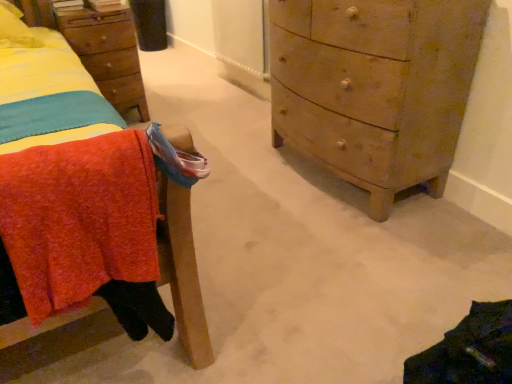
Question: Is wooden chest of drawers at right surrounded by knitted wool blanket at left?

Choices:
 (A) no
 (B) yes

Answer: (A)

Question: Does knitted wool blanket at left lie in front of wooden chest of drawers at right?

Choices:
 (A) no
 (B) yes

Answer: (B)

Question: Considering the relative sizes of knitted wool blanket at left and wooden chest of drawers at right in the image provided, is knitted wool blanket at left bigger than wooden chest of drawers at right?

Choices:
 (A) no
 (B) yes

Answer: (A)

Question: Does knitted wool blanket at left appear on the left side of wooden chest of drawers at right?

Choices:
 (A) yes
 (B) no

Answer: (A)

Question: From a real-world perspective, is knitted wool blanket at left located higher than wooden chest of drawers at right?

Choices:
 (A) no
 (B) yes

Answer: (B)

Question: Is wooden chest of drawers at right inside or outside of wooden nightstand at upper left?

Choices:
 (A) inside
 (B) outside

Answer: (B)

Question: In terms of width, does wooden chest of drawers at right look wider or thinner when compared to wooden nightstand at upper left?

Choices:
 (A) wide
 (B) thin

Answer: (A)

Question: Visually, is wooden chest of drawers at right positioned to the left or to the right of wooden nightstand at upper left?

Choices:
 (A) right
 (B) left

Answer: (A)

Question: Does point (374, 92) appear closer or farther from the camera than point (119, 99)?

Choices:
 (A) closer
 (B) farther

Answer: (A)

Question: From the image's perspective, is knitted wool blanket at left above or below wooden chest of drawers at right?

Choices:
 (A) below
 (B) above

Answer: (A)

Question: Is knitted wool blanket at left inside the boundaries of wooden chest of drawers at right, or outside?

Choices:
 (A) outside
 (B) inside

Answer: (A)

Question: In terms of height, does knitted wool blanket at left look taller or shorter compared to wooden chest of drawers at right?

Choices:
 (A) short
 (B) tall

Answer: (A)

Question: From a real-world perspective, relative to wooden chest of drawers at right, is knitted wool blanket at left vertically above or below?

Choices:
 (A) above
 (B) below

Answer: (A)

Question: Considering the relative positions of wooden nightstand at upper left and knitted wool blanket at left in the image provided, is wooden nightstand at upper left to the left or to the right of knitted wool blanket at left?

Choices:
 (A) right
 (B) left

Answer: (B)

Question: Is wooden nightstand at upper left inside the boundaries of knitted wool blanket at left, or outside?

Choices:
 (A) outside
 (B) inside

Answer: (A)